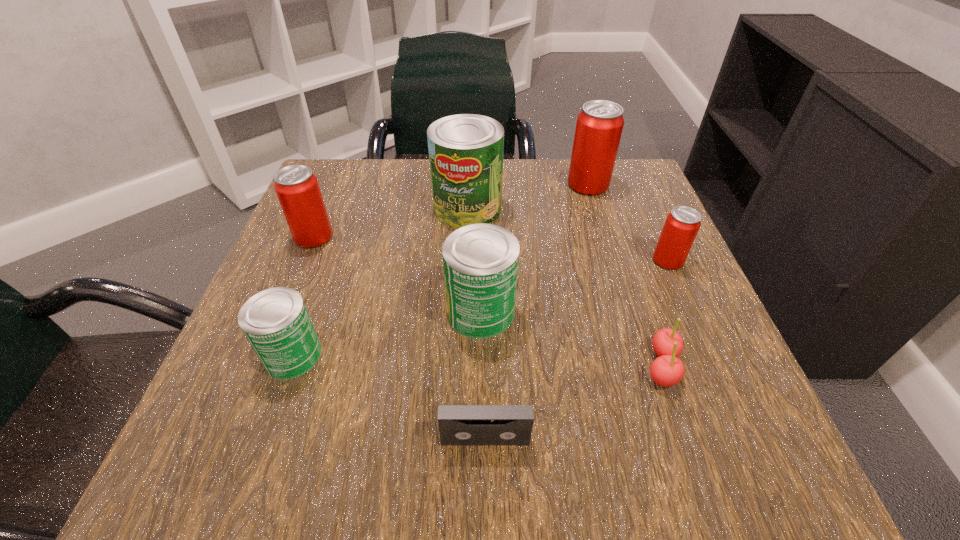
This screenshot has width=960, height=540. I want to click on the biggest red can, so click(x=599, y=126).

The height and width of the screenshot is (540, 960). What are the coordinates of `the second red can from right to left` in the screenshot? It's located at (599, 126).

This screenshot has width=960, height=540. Identify the location of the farthest green can. (466, 150).

Where is `the second biggest red can`? Image resolution: width=960 pixels, height=540 pixels. the second biggest red can is located at coordinates (297, 188).

Find the location of a particular element. The height and width of the screenshot is (540, 960). the leftmost red can is located at coordinates (297, 188).

At what (x,y) coordinates should I click in order to perform the action: click on the second smallest green can. Please return your answer as a coordinate pair (x, y). Looking at the image, I should click on (480, 261).

This screenshot has height=540, width=960. In order to click on the fourth farthest object in this screenshot , I will do `click(682, 224)`.

Image resolution: width=960 pixels, height=540 pixels. In order to click on the rightmost red can in this screenshot , I will do `click(682, 224)`.

Find the location of `the smallest green can`. the smallest green can is located at coordinates (275, 321).

What are the coordinates of `red cherry` in the screenshot? It's located at (667, 370).